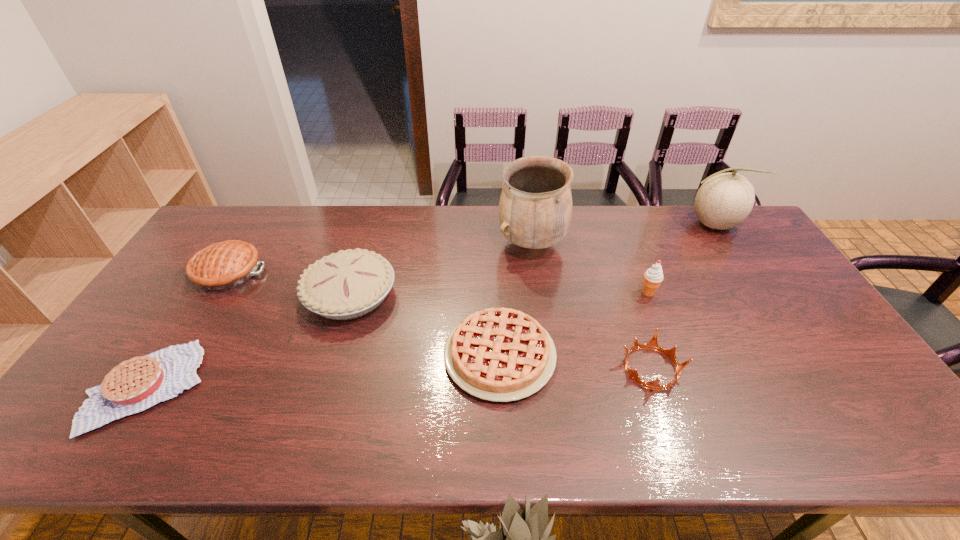
This screenshot has width=960, height=540. I want to click on object that is at the right edge, so click(x=724, y=200).

You are a GUI agent. You are given a task and a screenshot of the screen. Output one action in this format:
    pyautogui.click(x=<x>, y=<y>)
    Task: Click on the object at the near left corner
    Image resolution: width=960 pixels, height=540 pixels.
    Given the screenshot: What is the action you would take?
    pyautogui.click(x=137, y=384)

Identify the location of object that is at the far right corner. (724, 200).

At what (x,y) coordinates should I click in order to perform the action: click on vacant point at the far edge. Please return your answer as a coordinate pair (x, y). This screenshot has height=540, width=960. Looking at the image, I should click on (588, 240).

This screenshot has height=540, width=960. I want to click on vacant space at the near edge of the desktop, so click(x=305, y=443).

Where is `vacant position at the left edge of the desktop`? Image resolution: width=960 pixels, height=540 pixels. vacant position at the left edge of the desktop is located at coordinates (158, 323).

At what (x,y) coordinates should I click in order to perform the action: click on free region at the right edge. Please return your answer as a coordinate pair (x, y). This screenshot has width=960, height=540. Looking at the image, I should click on (725, 249).

Where is `free space between the sixth tallest object and the urn`? free space between the sixth tallest object and the urn is located at coordinates (591, 306).

The width and height of the screenshot is (960, 540). I want to click on blank region between the icecream and the rightmost object, so click(x=680, y=259).

Find the location of a particular element. The height and width of the screenshot is (540, 960). free spot between the urn and the third tallest object is located at coordinates (590, 268).